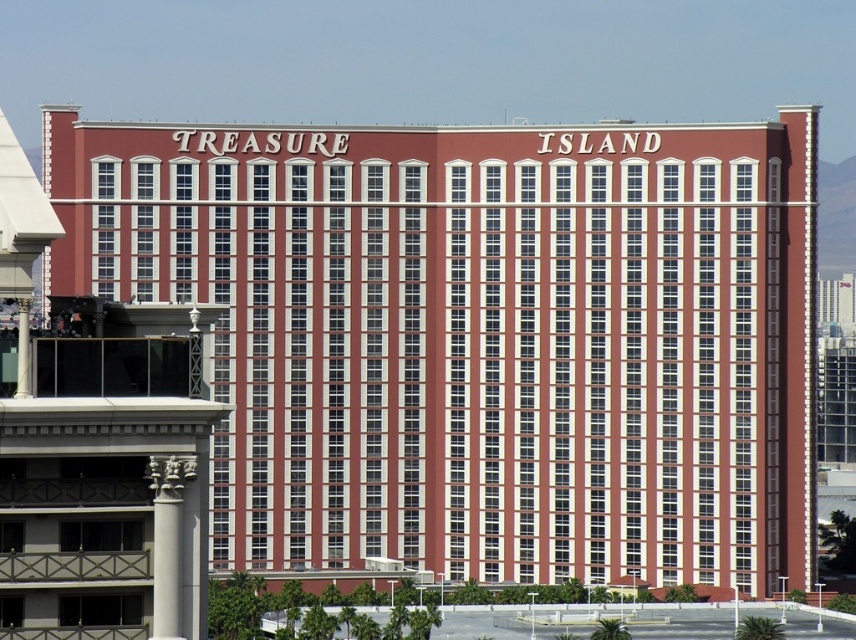
You are standing at the camera position and want to reach the point marked as point (752, 332). If you walk straight ahead, will you reach this point before walking 200 meters?

The point (752, 332) is 210.38 meters away from the camera, so you will not reach it before walking 200 meters.

You are standing in front of the Treasure Island hotel and casino. You see the red brick building at center and the white glossy column at lower left. Which one is higher from the ground?

The red brick building at center is above the white glossy column at lower left, so it is higher from the ground.

You are standing in front of the Treasure Island hotel and casino. You notice two points marked on the building facade. One is at coordinates point (484, 390) and the other at point (176, 563). Which point is closer to your current position?

Point (484, 390) is further to the camera than point (176, 563), so the point closer to your current position is point (176, 563).